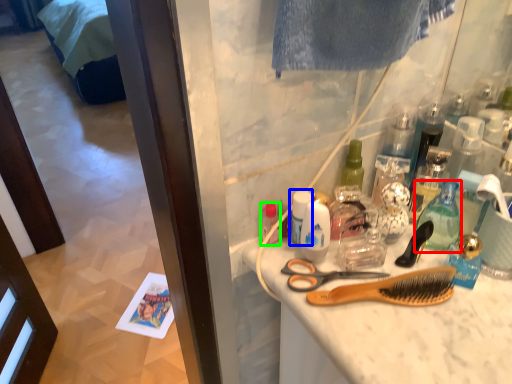
Question: Which object is the closest to the bottle (highlighted by a red box)? Choose among these: mouthwash (highlighted by a blue box) or toiletry (highlighted by a green box).

Choices:
 (A) mouthwash
 (B) toiletry

Answer: (A)